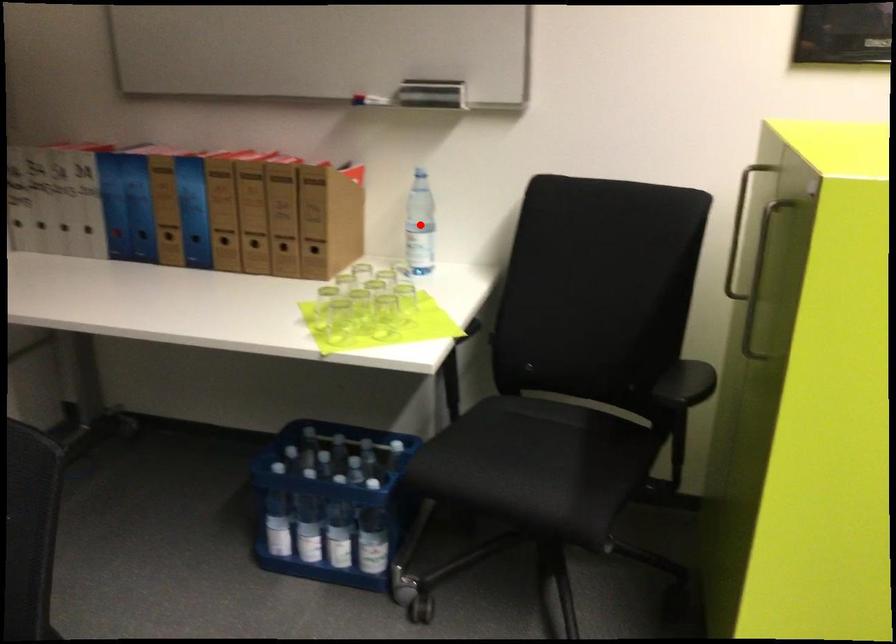
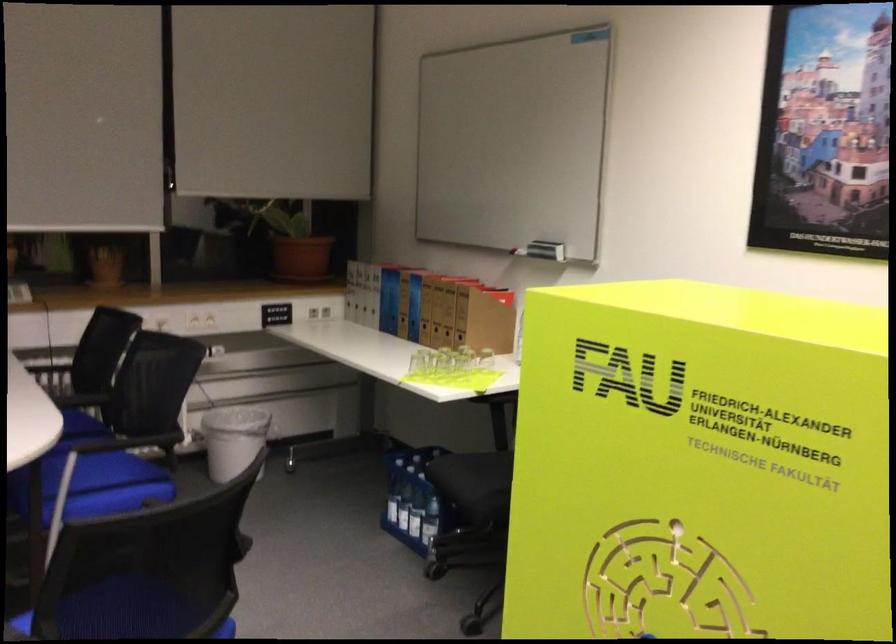
Question: I am providing you with two images of the same scene from different viewpoints. A red point is marked on the first image. Is the red point's position out of view in image 2?

Choices:
 (A) Yes
 (B) No

Answer: (A)